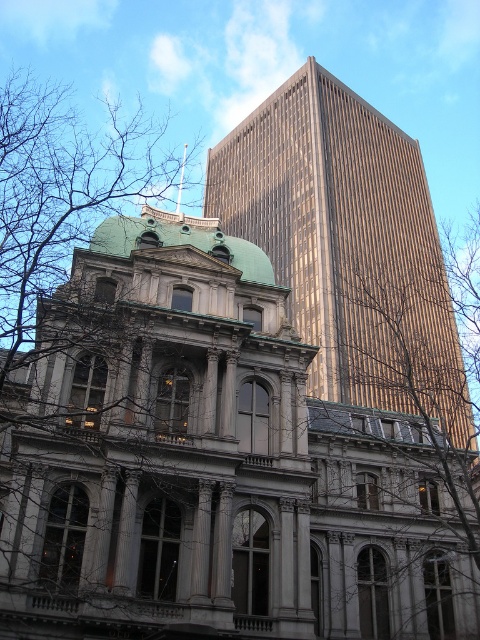
Question: Which point appears closest to the camera in this image?

Choices:
 (A) (352, 310)
 (B) (59, 205)

Answer: (B)

Question: Is gold reflective glass tower at upper center thinner than bare branches at left?

Choices:
 (A) no
 (B) yes

Answer: (B)

Question: Is gold reflective glass tower at upper center positioned in front of bare branches at left?

Choices:
 (A) yes
 (B) no

Answer: (B)

Question: Which of the following is the farthest from the observer?

Choices:
 (A) (412, 301)
 (B) (136, 132)

Answer: (B)

Question: Among these objects, which one is nearest to the camera?

Choices:
 (A) gold reflective glass tower at upper center
 (B) bare branches at left

Answer: (B)

Question: Does gold reflective glass tower at upper center appear on the left side of bare branches at left?

Choices:
 (A) yes
 (B) no

Answer: (B)